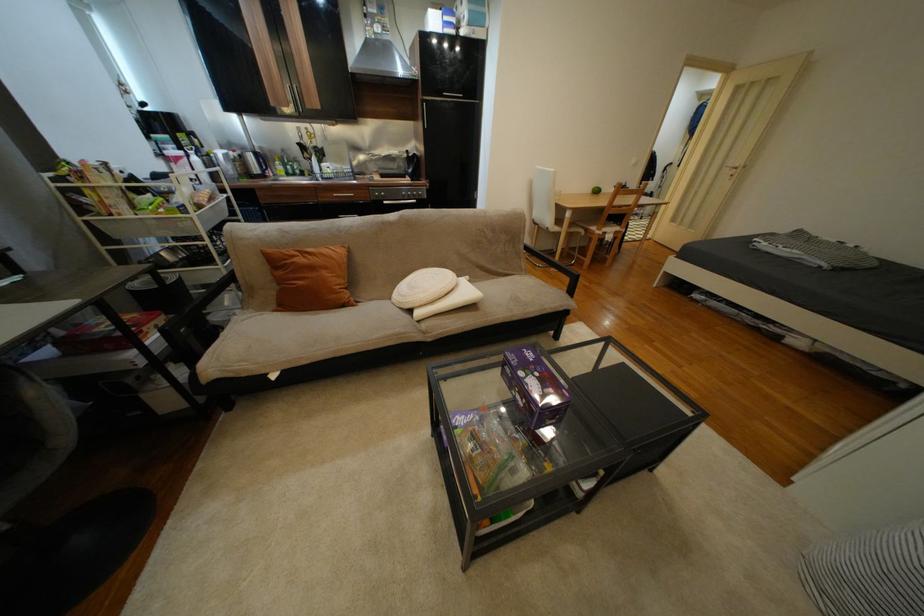
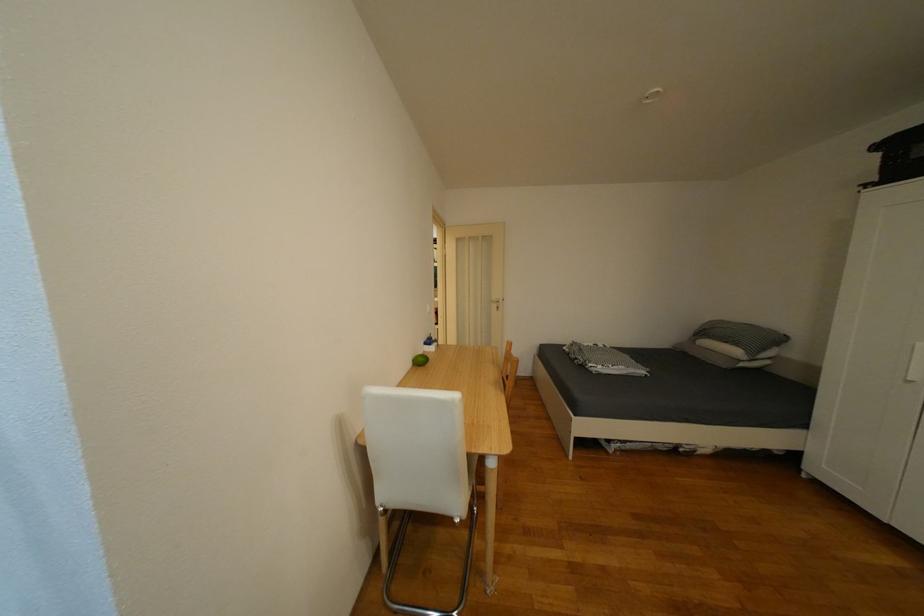
Find the pixel in the second image that matches point 788,246 in the first image.

(618, 368)